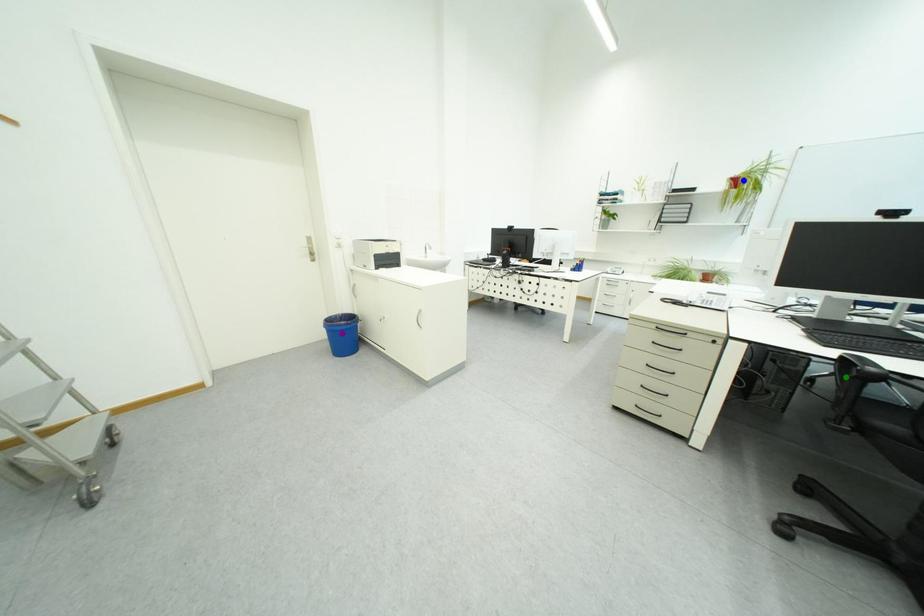
Order these from farthest to nearest:
green point | purple point | blue point

1. blue point
2. purple point
3. green point